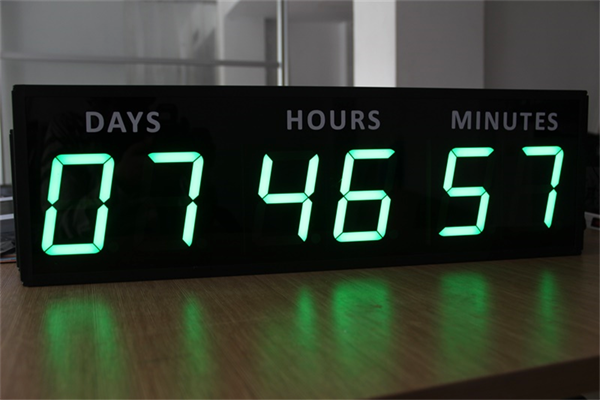
Find the location of `wall`. wall is located at coordinates (559, 28), (467, 28).